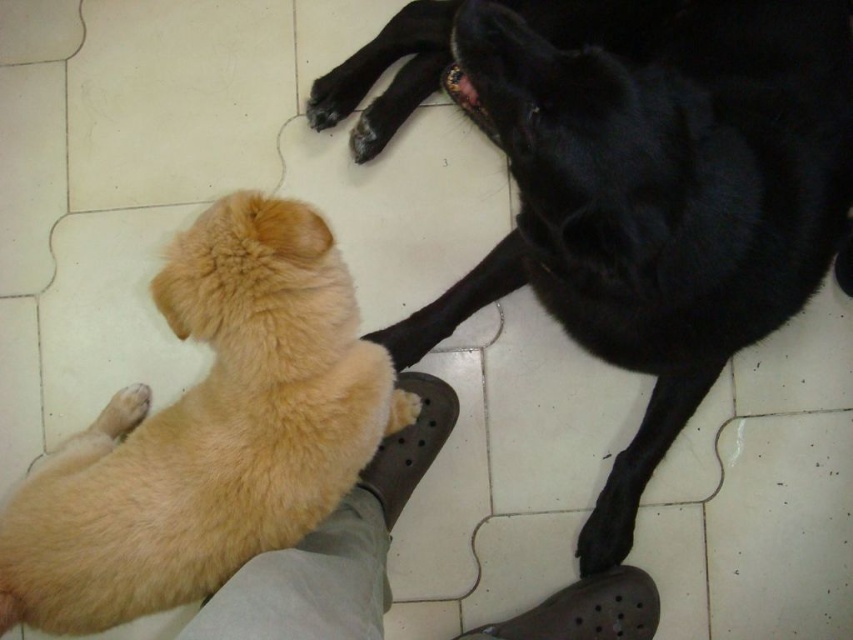
Who is positioned more to the right, shiny black dog at upper right or golden fur dog at lower left?

From the viewer's perspective, shiny black dog at upper right appears more on the right side.

Between point (630, 154) and point (16, 611), which one is positioned in front?

Positioned in front is point (630, 154).

This screenshot has height=640, width=853. What are the coordinates of `shiny black dog at upper right` in the screenshot? It's located at (635, 172).

Is shiny black dog at upper right thinner than beige fabric pants at lower left?

Answer: No.

Is the position of shiny black dog at upper right more distant than that of beige fabric pants at lower left?

That is True.

Describe the element at coordinates (635, 172) in the screenshot. I see `shiny black dog at upper right` at that location.

Locate an element on the screen. Image resolution: width=853 pixels, height=640 pixels. shiny black dog at upper right is located at coordinates (635, 172).

This screenshot has height=640, width=853. I want to click on golden fur dog at lower left, so click(x=210, y=433).

Can you confirm if golden fur dog at lower left is positioned above black matte paw at lower center?

Indeed, golden fur dog at lower left is positioned over black matte paw at lower center.

Is point (6, 577) more distant than point (601, 532)?

No, (6, 577) is closer to viewer.

The height and width of the screenshot is (640, 853). Identify the location of golden fur dog at lower left. (210, 433).